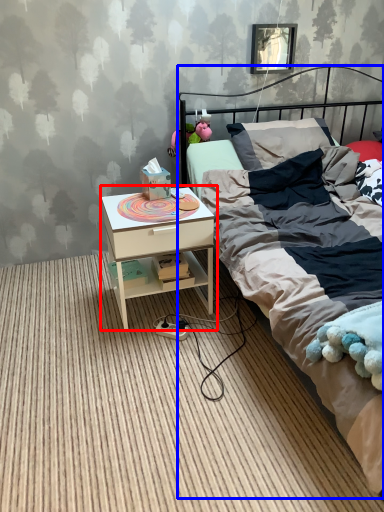
Question: Which object appears closest to the camera in this image, nightstand (highlighted by a red box) or bed (highlighted by a blue box)?

Choices:
 (A) nightstand
 (B) bed

Answer: (B)